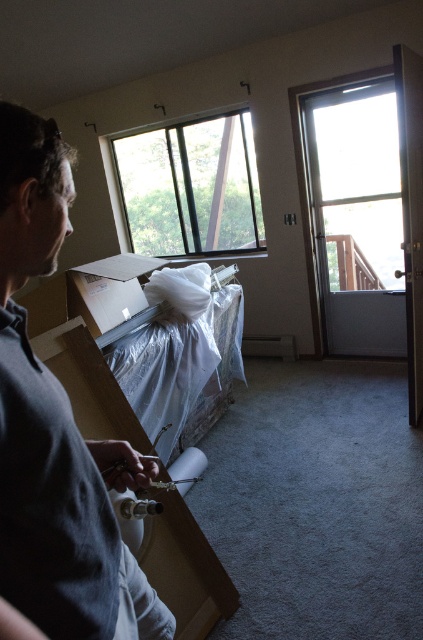
You are moving into a new apartment and need to determine if the matte brown cardboard box at left can fit through the clear glass window at upper center. Based on their sizes, can the box pass through the window?

The clear glass window at upper center is much taller than the matte brown cardboard box at left, so the box can pass through the window vertically. However, the horizontal width of the window isn not mentioned, so it is unclear if the box can fit horizontally.

You are standing in the room and see two points marked in the image. Which point is closer to you, point (148, 221) or point (51, 301)?

Point (148, 221) is closer to you than point (51, 301) because it is further to the viewer.